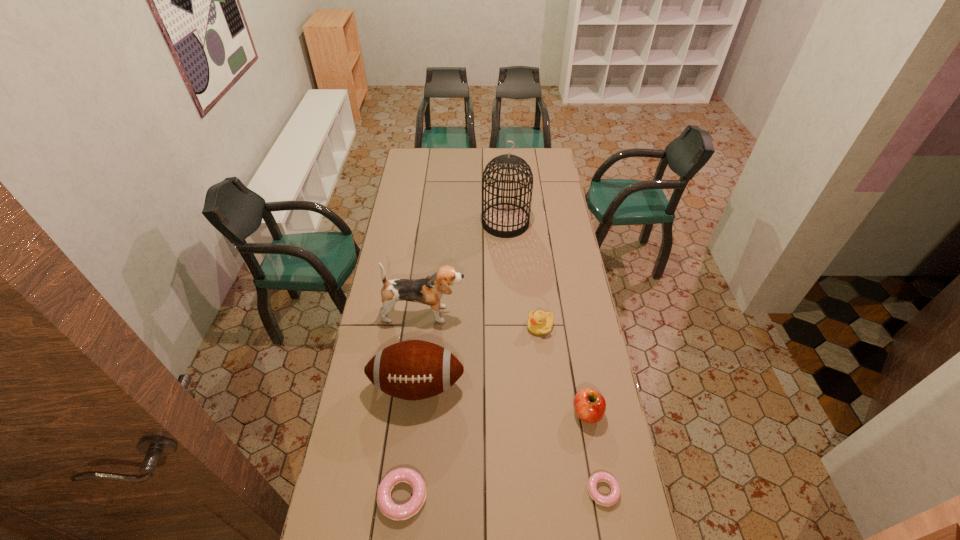
Locate an element on the screen. the sixth tallest object is located at coordinates (391, 510).

Find the location of a particular element. the left doughnut is located at coordinates (391, 510).

Find the location of a particular element. the right doughnut is located at coordinates (614, 496).

The height and width of the screenshot is (540, 960). In order to click on the shortest object in this screenshot , I will do `click(614, 496)`.

I want to click on puppy, so point(429,290).

This screenshot has width=960, height=540. I want to click on birdcage, so pyautogui.click(x=505, y=220).

Where is `the farthest object`? the farthest object is located at coordinates (505, 220).

Where is `duckling`? duckling is located at coordinates (539, 323).

Where is `the third tallest object`? the third tallest object is located at coordinates (412, 370).

Locate an element on the screen. apple is located at coordinates (589, 405).